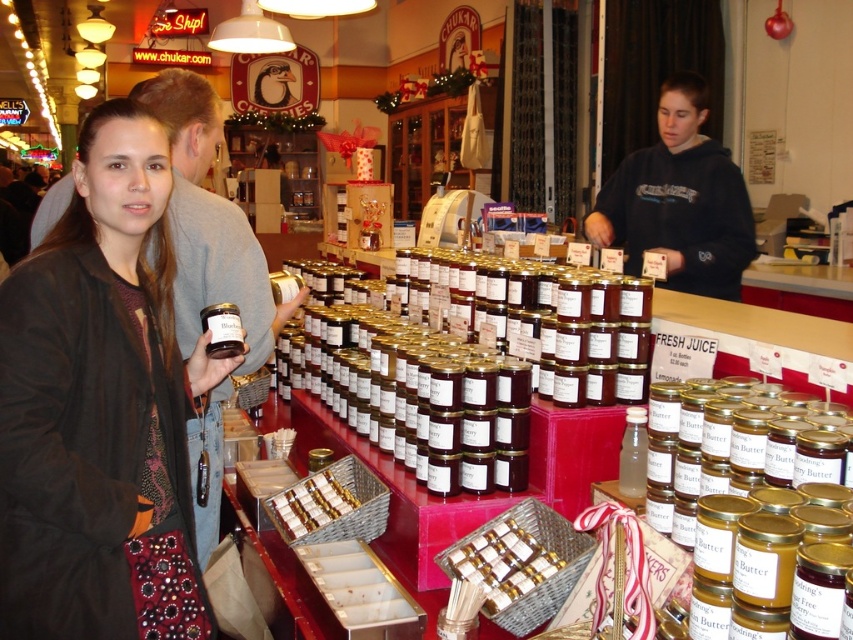
You are a customer in the store and want to place the shiny chocolate bar at center into your bag without moving the matte black jacket at left. Is this possible based on their sizes?

The matte black jacket at left is taller than the shiny chocolate bar at center, so yes, the chocolate bar can be placed into the bag without moving the jacket since it is shorter.

You are shopping at the artisanal goods store and see a black hoodie at center and a shiny chocolate bar at center. Which item is located to the right of the other?

The black hoodie at center is positioned on the right side of shiny chocolate bar at center.

You are standing in the market and see two points marked in the scene. The first point is at coordinates point (682, 224) and the second is at point (302, 488). Which point is closer to you?

Point (682, 224) is further to the camera than point (302, 488), so the closer point to you is point (302, 488).